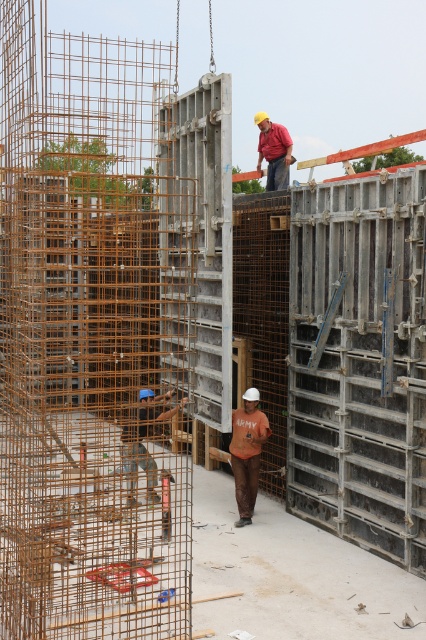
Which is in front, point (146, 426) or point (264, 150)?

Positioned in front is point (146, 426).

Between blue hard hat at center and red fabric shirt at upper center, which one has less height?

Standing shorter between the two is blue hard hat at center.

You are a GUI agent. You are given a task and a screenshot of the screen. Output one action in this format:
    pyautogui.click(x=<x>, y=<y>)
    Task: Click on the blue hard hat at center
    This screenshot has height=640, width=426.
    Given the screenshot: What is the action you would take?
    pyautogui.click(x=141, y=440)

Based on the photo, can you confirm if orange cotton shirt at center is wider than red fabric shirt at upper center?

In fact, orange cotton shirt at center might be narrower than red fabric shirt at upper center.

Does orange cotton shirt at center appear under red fabric shirt at upper center?

Yes, orange cotton shirt at center is below red fabric shirt at upper center.

Is point (252, 403) behind point (267, 140)?

No, it is in front of (267, 140).

Find the location of `orange cotton shirt at center`. orange cotton shirt at center is located at coordinates (247, 452).

Which is above, blue hard hat at center or orange cotton shirt at center?

blue hard hat at center is above.

Does point (147, 451) lie in front of point (238, 490)?

No, (147, 451) is behind (238, 490).

The image size is (426, 640). In order to click on blue hard hat at center in this screenshot , I will do 141,440.